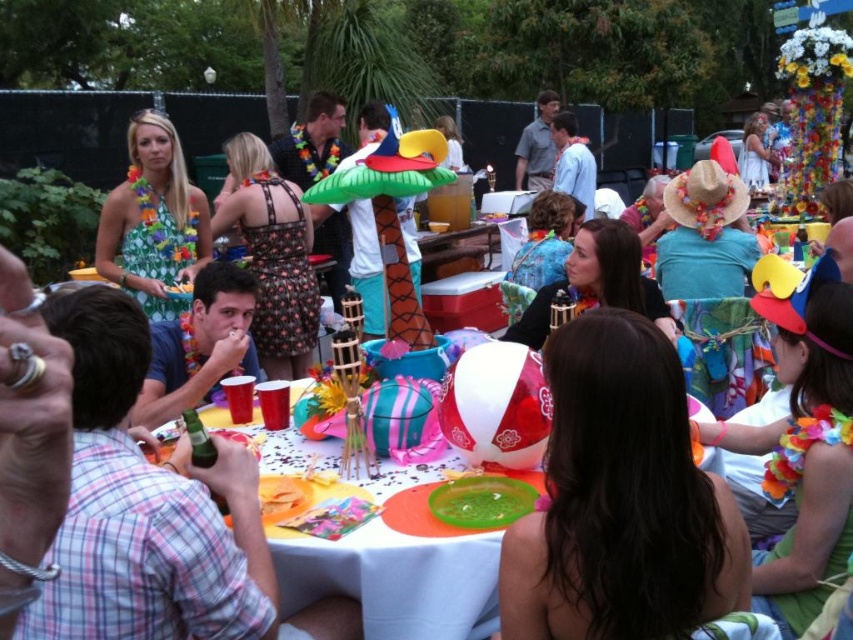
Question: Does plastic disposable plates at center lie in front of green floral dress at left?

Choices:
 (A) no
 (B) yes

Answer: (B)

Question: Can you confirm if plastic disposable plates at center is positioned to the left of green floral dress at left?

Choices:
 (A) yes
 (B) no

Answer: (B)

Question: Which object is the farthest from the plastic disposable plates at center?

Choices:
 (A) dark brown hair at center
 (B) green floral dress at left

Answer: (B)

Question: Among these points, which one is farthest from the camera?

Choices:
 (A) coord(131,248)
 (B) coord(595,506)

Answer: (A)

Question: Among these points, which one is nearest to the camera?

Choices:
 (A) pyautogui.click(x=370, y=634)
 (B) pyautogui.click(x=650, y=509)
 (C) pyautogui.click(x=119, y=196)

Answer: (B)

Question: Considering the relative positions of dark brown hair at center and plastic disposable plates at center in the image provided, where is dark brown hair at center located with respect to plastic disposable plates at center?

Choices:
 (A) above
 (B) below

Answer: (A)